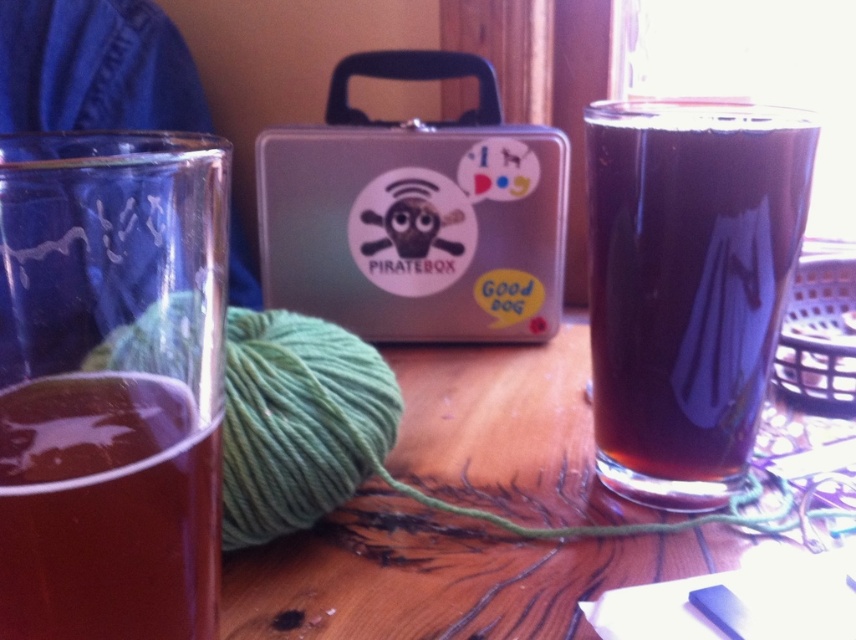
Question: Can you confirm if dark brown liquid at right is positioned to the right of brown translucent liquid at left?

Choices:
 (A) yes
 (B) no

Answer: (A)

Question: Can you confirm if dark brown liquid at right is positioned above brown translucent liquid at left?

Choices:
 (A) no
 (B) yes

Answer: (B)

Question: Does dark brown liquid at right appear over brown translucent liquid at left?

Choices:
 (A) no
 (B) yes

Answer: (B)